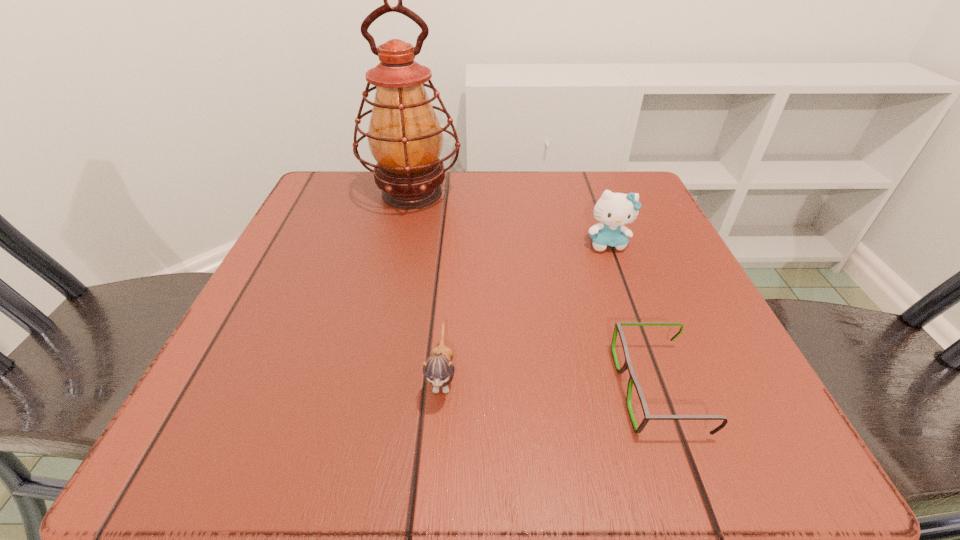
Identify the location of free region located 0.110m on the lens of the spectacles. (540, 389).

Identify the location of vacant region located 0.280m on the lens of the spectacles. The image size is (960, 540). (412, 389).

Locate an element on the screen. free spot located on the lens of the spectacles is located at coordinates (502, 389).

The width and height of the screenshot is (960, 540). I want to click on object at the far edge, so click(405, 138).

Find the location of a particular element. This screenshot has width=960, height=540. kitten located in the near edge section of the desktop is located at coordinates (438, 369).

Find the location of a particular element. The height and width of the screenshot is (540, 960). spectacles at the near edge is located at coordinates (618, 329).

Where is `object that is positioned at the left edge`? The width and height of the screenshot is (960, 540). object that is positioned at the left edge is located at coordinates (405, 138).

Locate an element on the screen. The image size is (960, 540). kitten that is at the right edge is located at coordinates (614, 210).

Find the location of `spectacles situated at the right edge`. spectacles situated at the right edge is located at coordinates (618, 329).

Identify the location of object that is at the far left corner. Image resolution: width=960 pixels, height=540 pixels. (405, 138).